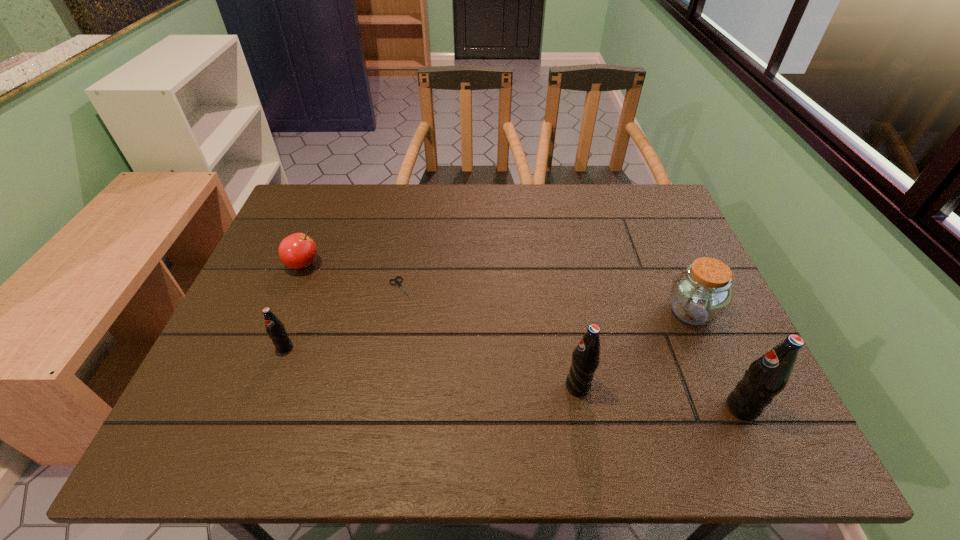
Image resolution: width=960 pixels, height=540 pixels. Identify the location of the farthest pop. (275, 329).

Locate an element on the screen. the third nearest object is located at coordinates (275, 329).

Locate an element on the screen. This screenshot has height=540, width=960. the third object from right to left is located at coordinates (586, 356).

Locate an element on the screen. The image size is (960, 540). the second shortest pop is located at coordinates (586, 356).

Locate an element on the screen. The height and width of the screenshot is (540, 960). the rightmost pop is located at coordinates (767, 376).

Locate an element on the screen. The width and height of the screenshot is (960, 540). shears is located at coordinates (398, 283).

Locate an element on the screen. The image size is (960, 540). the shortest object is located at coordinates (398, 283).

The width and height of the screenshot is (960, 540). In order to click on apple in this screenshot , I will do `click(297, 251)`.

I want to click on jar, so click(x=700, y=294).

The width and height of the screenshot is (960, 540). I want to click on blank space located 0.050m on the front label of the second tallest pop, so click(x=541, y=386).